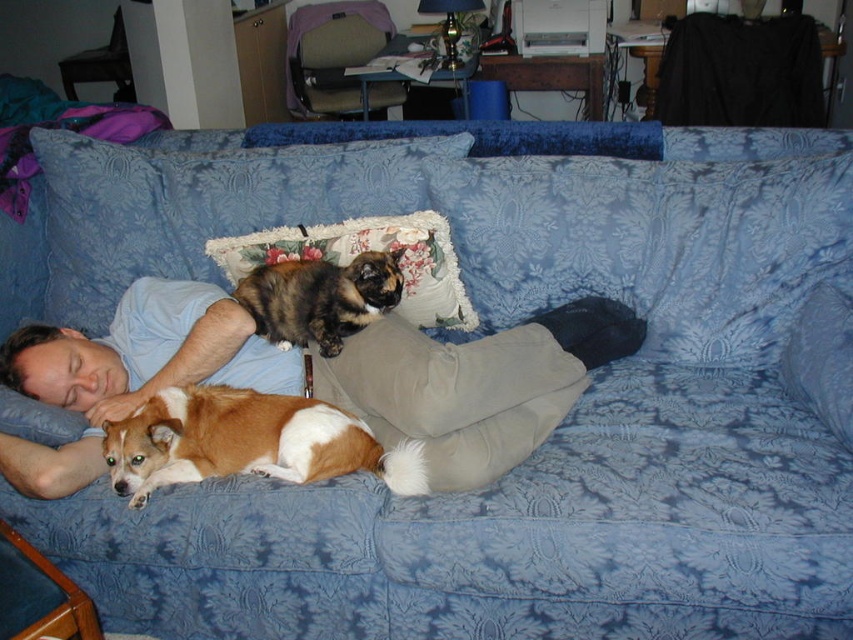
Question: Can you confirm if light blue cotton shirt at center is positioned to the left of brown and white fur at center?

Choices:
 (A) no
 (B) yes

Answer: (A)

Question: Which of the following is the farthest from the observer?

Choices:
 (A) light blue cotton shirt at center
 (B) brown and white fur at lower left

Answer: (A)

Question: Estimate the real-world distances between objects in this image. Which object is closer to the floral fabric pillow at center?

Choices:
 (A) light blue cotton shirt at center
 (B) brown and white fur at center

Answer: (B)

Question: Which object is the farthest from the brown and white fur at lower left?

Choices:
 (A) brown and white fur at center
 (B) light blue cotton shirt at center
 (C) floral fabric pillow at center

Answer: (C)

Question: Does brown and white fur at lower left appear on the right side of brown and white fur at center?

Choices:
 (A) yes
 (B) no

Answer: (B)

Question: Is light blue cotton shirt at center closer to camera compared to brown and white fur at lower left?

Choices:
 (A) yes
 (B) no

Answer: (B)